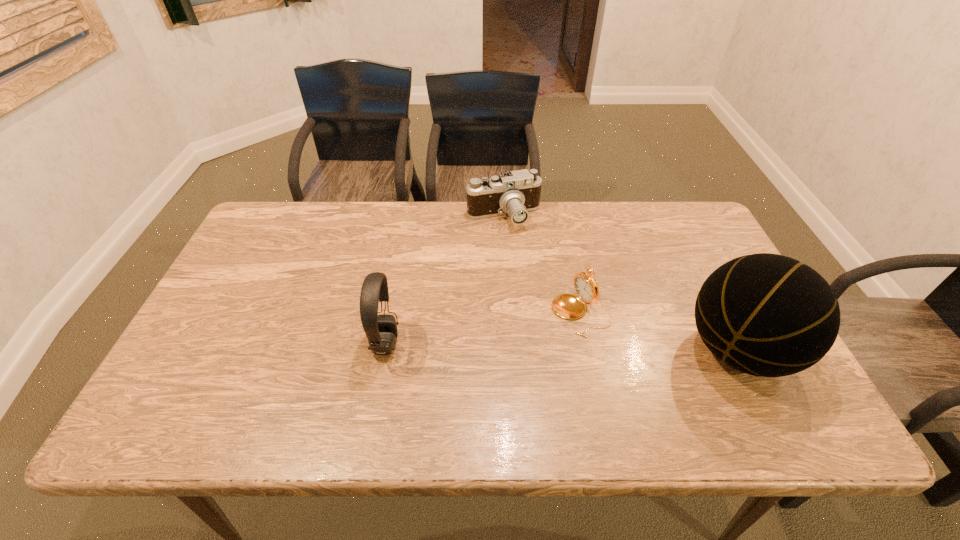
The image size is (960, 540). What are the coordinates of `the second tallest object` in the screenshot? It's located at (381, 330).

I want to click on headset, so click(381, 330).

Where is `basketball`? The image size is (960, 540). basketball is located at coordinates click(x=768, y=315).

Where is `the rightmost object`? the rightmost object is located at coordinates (768, 315).

Identify the location of pocket watch. Image resolution: width=960 pixels, height=540 pixels. (568, 306).

Find the location of a particular element. The height and width of the screenshot is (540, 960). camera is located at coordinates (515, 193).

You are a GUI agent. You are given a task and a screenshot of the screen. Output one action in this format:
    pyautogui.click(x=<x>, y=<y>)
    Task: Click on the vacant region located 0.340m on the front-facing side of the leftmost object
    
    Given the screenshot: What is the action you would take?
    pyautogui.click(x=537, y=343)

The height and width of the screenshot is (540, 960). I want to click on vacant space located on the back of the basketball, so click(x=694, y=262).

Locate an element on the screen. The width and height of the screenshot is (960, 540). free space located on the face of the pocket watch is located at coordinates (460, 369).

At what (x,y) coordinates should I click in order to perform the action: click on vacant space located 0.360m on the face of the pocket watch. Please return your answer as a coordinate pair (x, y). This screenshot has width=960, height=540. Looking at the image, I should click on (428, 383).